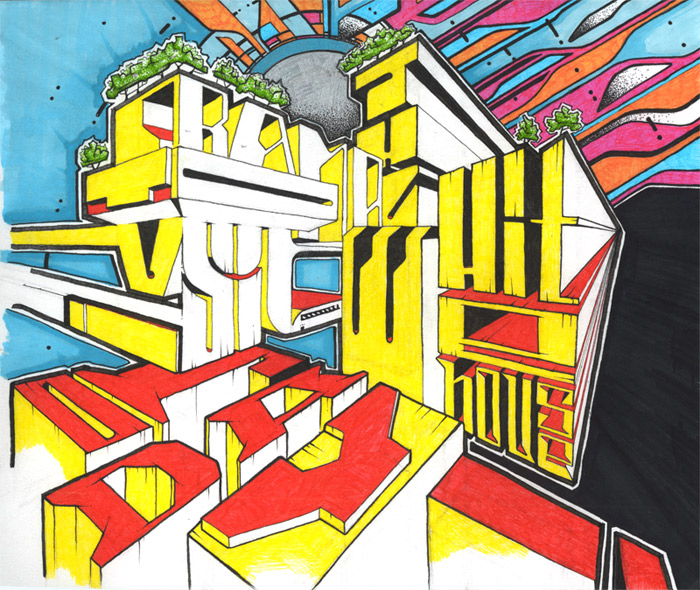
Locate an element on the screen. art is located at coordinates (586, 414).